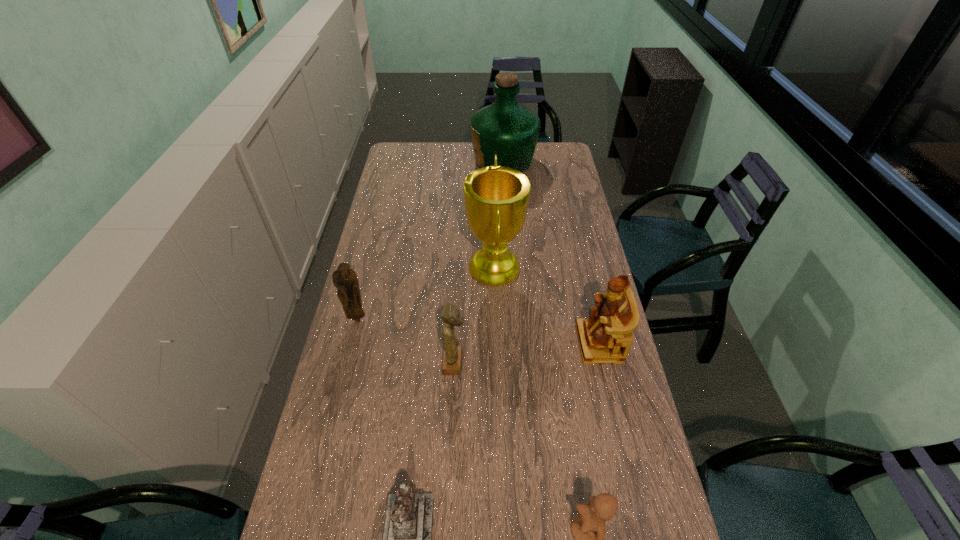
I want to click on free spot at the far edge of the desktop, so click(x=467, y=153).

Locate an element on the screen. vacant space at the left edge of the desktop is located at coordinates (353, 445).

Locate an element on the screen. This screenshot has height=540, width=960. vacant space at the right edge of the desktop is located at coordinates (556, 176).

Where is `free point at the far left corner`? This screenshot has height=540, width=960. free point at the far left corner is located at coordinates (395, 143).

The height and width of the screenshot is (540, 960). Find the location of `vacant area between the rightmost figurine and the farthest figurine`. vacant area between the rightmost figurine and the farthest figurine is located at coordinates (478, 331).

Locate an element on the screen. Image resolution: width=960 pixels, height=540 pixels. free spot between the leftmost object and the rightmost figurine is located at coordinates (478, 331).

Identify the location of vacant space that's between the rightmost figurine and the leftmost object. This screenshot has width=960, height=540. tap(478, 331).

Image resolution: width=960 pixels, height=540 pixels. I want to click on empty space that is in between the farthest object and the leftmost figurine, so click(430, 240).

Locate an element on the screen. This screenshot has height=540, width=960. object that is the second closest to the fourth figurine from left to right is located at coordinates (606, 336).

Select which object is the fourth closest to the rightmost object. Please provide its 2D coordinates. Your answer should be formatted as a tuple, i.e. [(x, y)], where the tuple contains the x and y coordinates of a point satisfying the conditions above.

[(407, 539)]